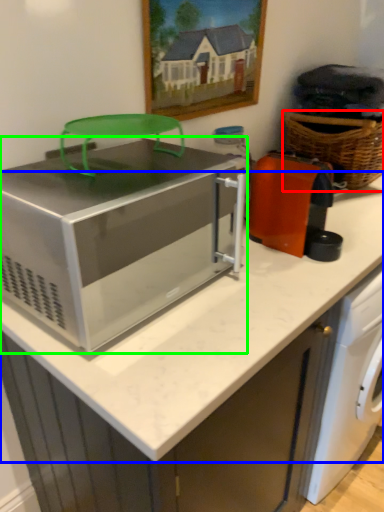
Question: Considering the real-world distances, which object is closest to basket (highlighted by a red box)? counter top (highlighted by a blue box) or home appliance (highlighted by a green box).

Choices:
 (A) counter top
 (B) home appliance

Answer: (B)